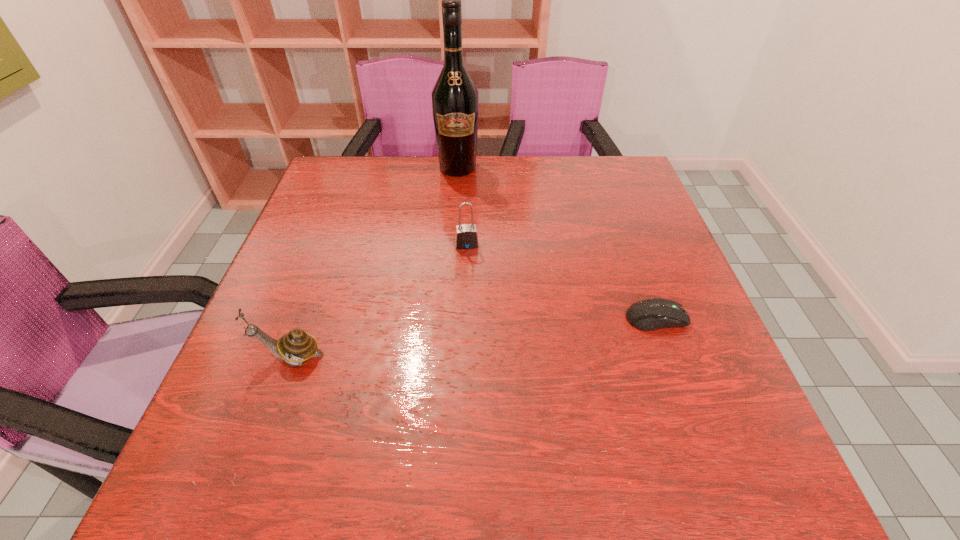
Locate an element on the screen. the nearest object is located at coordinates [297, 346].

I want to click on snail, so click(x=297, y=346).

This screenshot has width=960, height=540. I want to click on the shortest object, so click(650, 314).

Locate an element on the screen. The image size is (960, 540). the third farthest object is located at coordinates [x=650, y=314].

At what (x,y) coordinates should I click in order to perform the action: click on the farthest object. Please return your answer as a coordinate pair (x, y). Looking at the image, I should click on (455, 106).

Where is `wine bottle`? wine bottle is located at coordinates (455, 106).

You are a GUI agent. You are given a task and a screenshot of the screen. Output one action in this format:
    pyautogui.click(x=<x>, y=<y>)
    Task: Click on the padlock
    
    Given the screenshot: What is the action you would take?
    pyautogui.click(x=466, y=237)

The height and width of the screenshot is (540, 960). Identify the location of vacant position located 0.110m on the label of the farthest object. (461, 201).

Locate an element on the screen. The width and height of the screenshot is (960, 540). vacant space situated on the label of the farthest object is located at coordinates (468, 272).

The width and height of the screenshot is (960, 540). Find the location of `vacant region located on the label of the farthest object`. vacant region located on the label of the farthest object is located at coordinates pos(467,249).